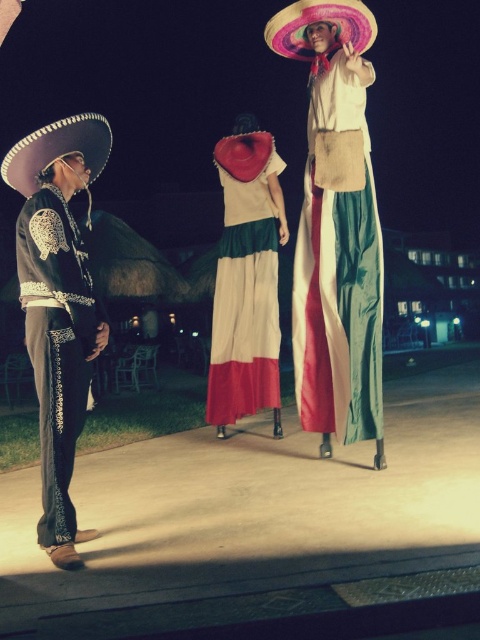
Who is lower down, white cotton dress at center or black satin mariachi outfit at left?

black satin mariachi outfit at left is below.

Locate an element on the screen. Image resolution: width=480 pixels, height=640 pixels. white cotton dress at center is located at coordinates (247, 280).

Is matte fabric dress at center positioned at the back of white cotton dress at center?

No, it is in front of white cotton dress at center.

Identify the location of matte fabric dress at center. The image size is (480, 640). (338, 273).

Is point (382, 244) closer to viewer compared to point (266, 148)?

Yes.

You are a GUI agent. You are given a task and a screenshot of the screen. Output one action in this format:
    pyautogui.click(x=<x>, y=<y>)
    Task: Click on the matte fabric dress at center
    This screenshot has width=480, height=640.
    Given the screenshot: What is the action you would take?
    pyautogui.click(x=338, y=273)

Who is lower down, black satin mariachi outfit at left or multicolored felt sombrero at upper center?

Positioned lower is black satin mariachi outfit at left.

Is black satin mariachi outfit at left above multicolored felt sombrero at upper center?

Actually, black satin mariachi outfit at left is below multicolored felt sombrero at upper center.

Looking at this image, who is more distant from viewer, (60, 496) or (304, 3)?

The point (304, 3) is behind.

At what (x,y) coordinates should I click in order to perform the action: click on black satin mariachi outfit at left. Please return your answer as a coordinate pair (x, y). The image size is (480, 640). Looking at the image, I should click on (56, 344).